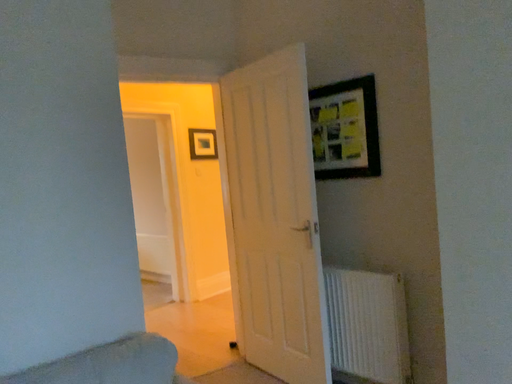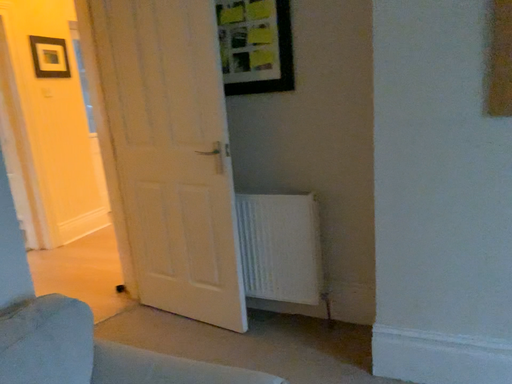
Question: How did the camera likely rotate when shooting the video?

Choices:
 (A) rotated right
 (B) rotated left

Answer: (A)